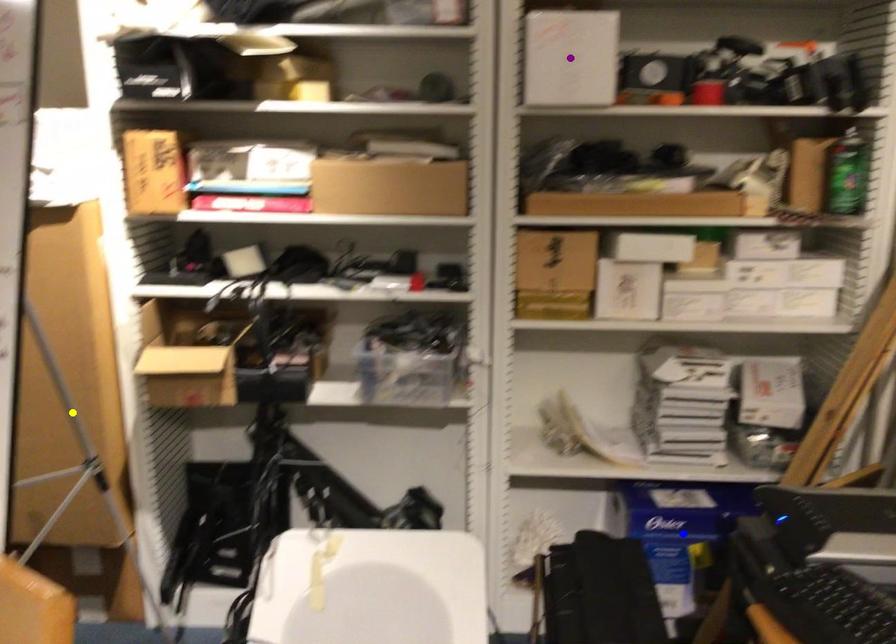
Order these from farthest to nearest:
blue point
purple point
yellow point

blue point → yellow point → purple point